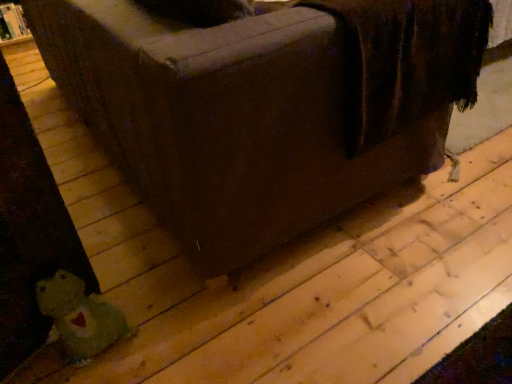
Image resolution: width=512 pixels, height=384 pixels. Find the location of `free point to the right of green plush toy at lower left`. free point to the right of green plush toy at lower left is located at coordinates (153, 337).